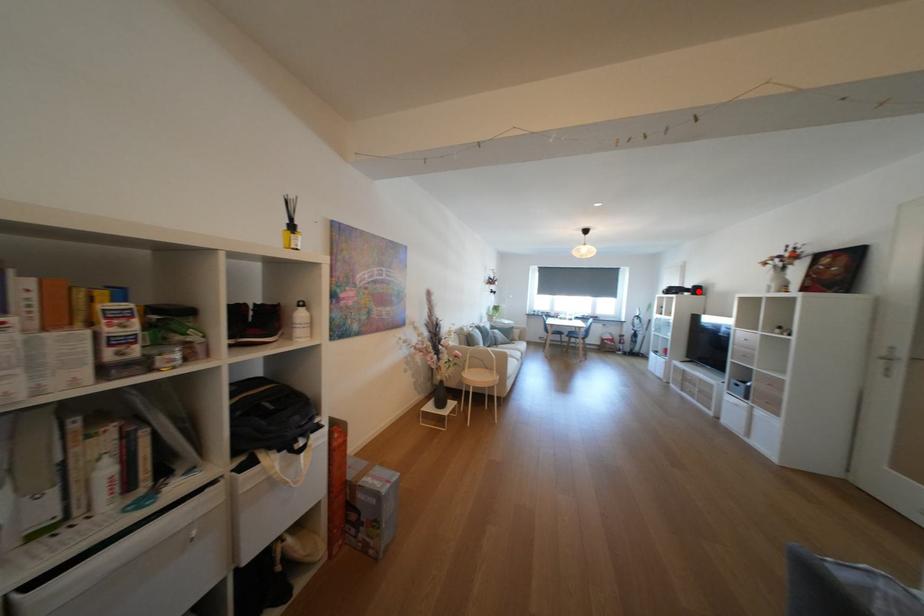
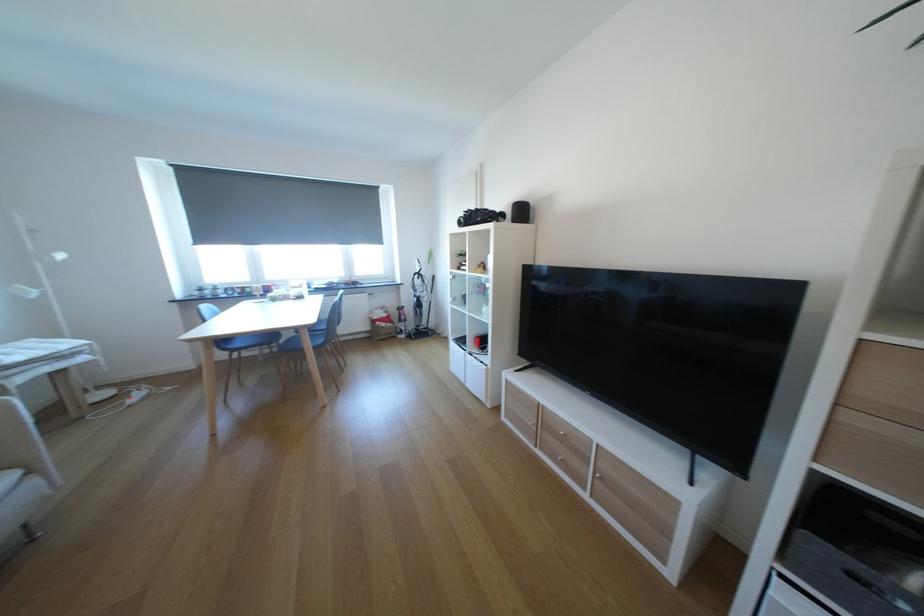
In the second image, find the point that corresponds to the highlighted location in the first image.

(514, 217)